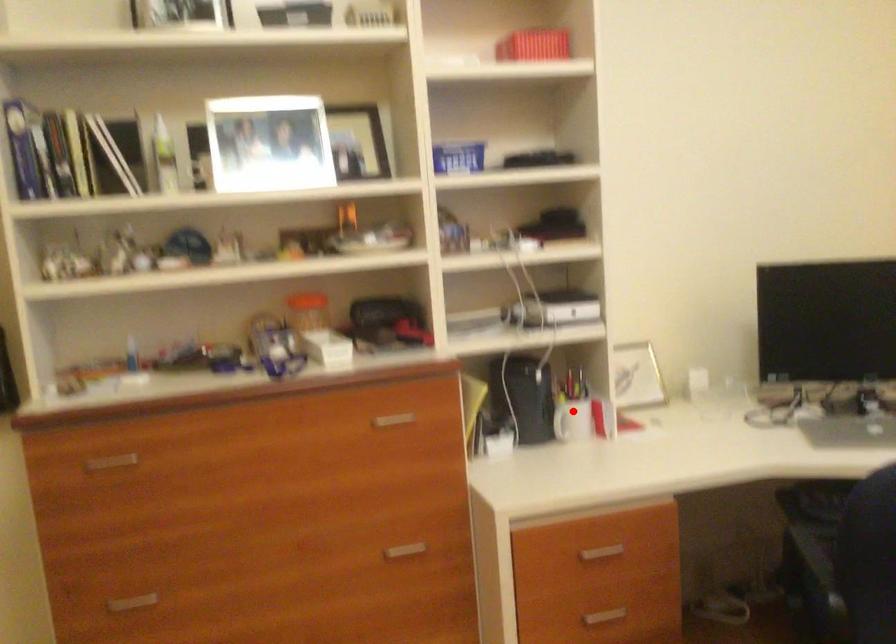
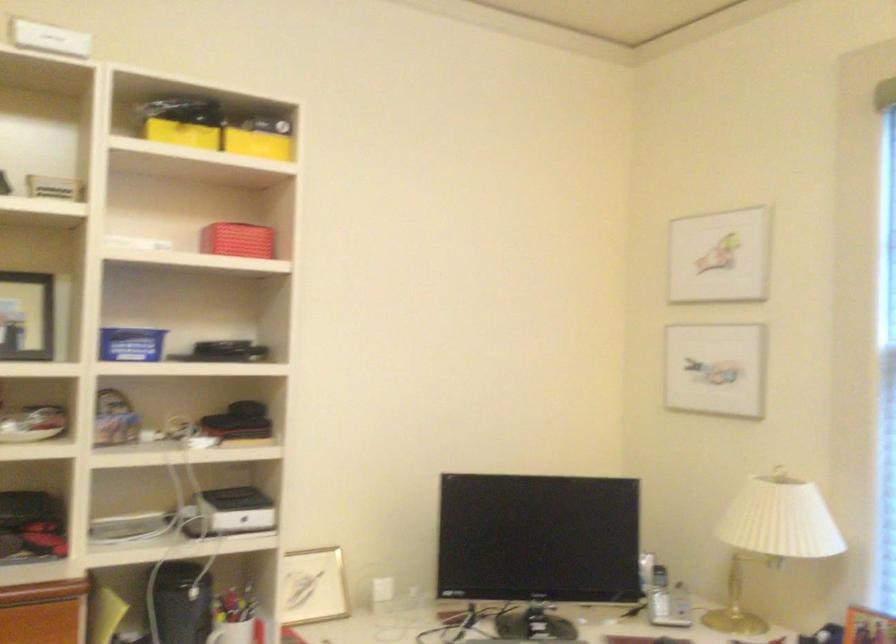
Find the pixel in the second image that matches the highlighted location in the first image.

(231, 632)